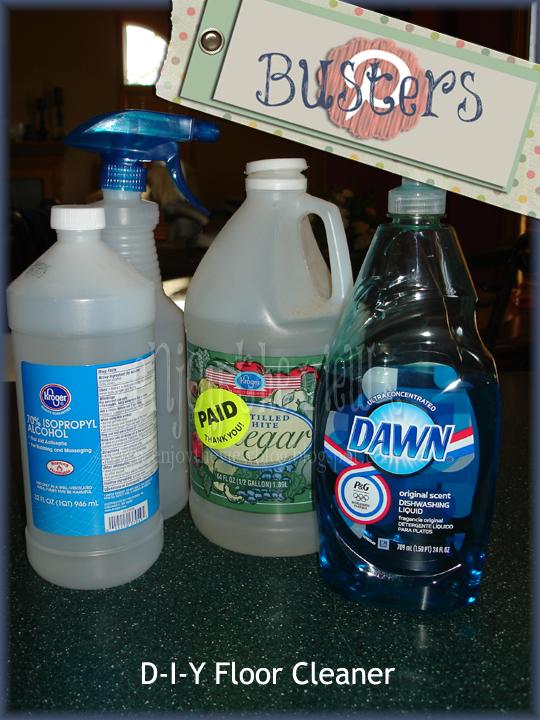
At what (x,y) coordinates should I click in order to perform the action: click on wall. Please return your answer as a coordinate pair (x, y). The width and height of the screenshot is (540, 720). Looking at the image, I should click on (33, 42).